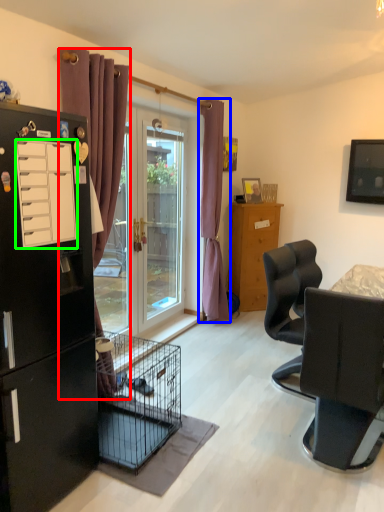
Question: Which object is the farthest from curtain (highlighted by a red box)? Choose among these: curtain (highlighted by a blue box) or drawer (highlighted by a green box).

Choices:
 (A) curtain
 (B) drawer

Answer: (A)